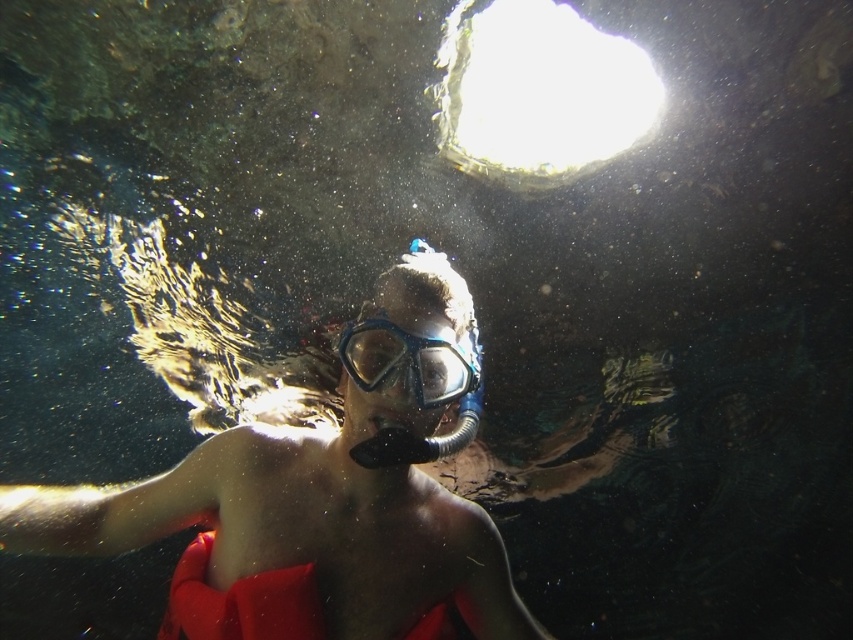
You are a marine biologist observing the underwater scene. You notice the matte skin diver at center and the transparent rubber goggles at center. Which object is positioned closer to your viewpoint?

The matte skin diver at center is closer to the viewer than the transparent rubber goggles at center.

You are a marine biologist observing the underwater scene. You need to determine if the matte skin diver at center can fit through a narrow opening that is just wide enough for the transparent rubber goggles at center. Can they pass through?

The matte skin diver at center might be wider than transparent rubber goggles at center, so there is a possibility they cannot pass through the narrow opening designed for the goggles.

You are a marine biologist observing the underwater scene. You notice the matte skin diver at center and the transparent rubber goggles at center. Based on their sizes, which object would you estimate is closer to the surface?

The matte skin diver at center is larger in size than the transparent rubber goggles at center. Since objects closer to the surface appear larger in the water, the matte skin diver at center is likely closer to the surface.